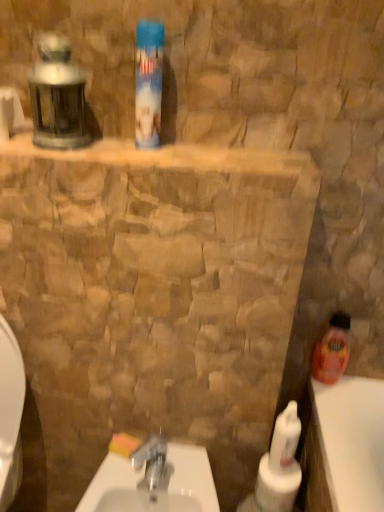
Where is `free point above white glossy sink at center (from a real-world perspective)`? free point above white glossy sink at center (from a real-world perspective) is located at coordinates (159, 471).